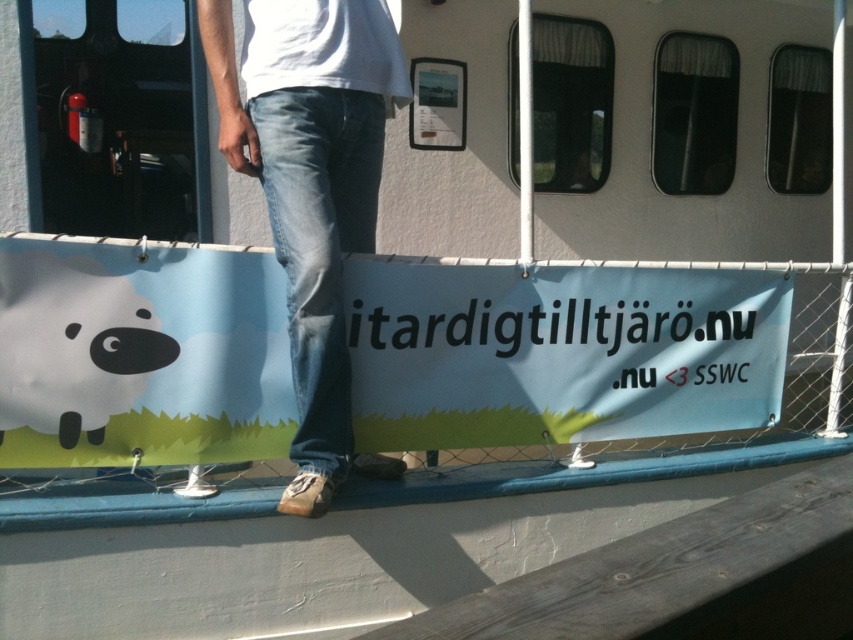
Which is in front, point (294, 292) or point (61, 406)?

Point (61, 406)

The image size is (853, 640). What do you see at coordinates (318, 244) in the screenshot?
I see `denim at center` at bounding box center [318, 244].

Where is `denim at center`? This screenshot has width=853, height=640. denim at center is located at coordinates (318, 244).